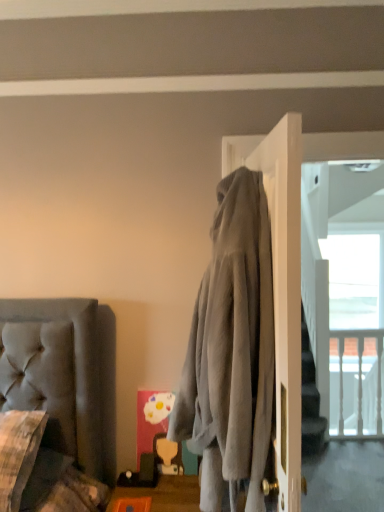
Find the location of `free point above gray fabric screen door at upper right (from a real-world perspective)`. free point above gray fabric screen door at upper right (from a real-world perspective) is located at coordinates (340, 125).